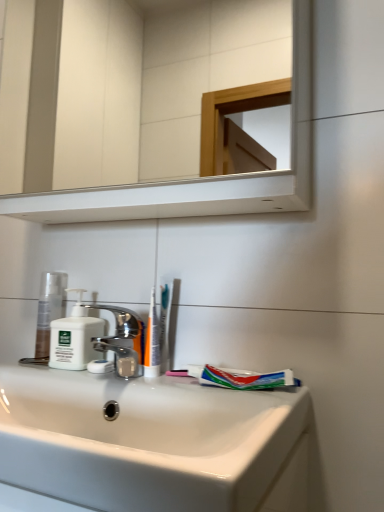
Question: Can you confirm if white matte soap dispenser at left is smaller than white glossy sink at lower center?

Choices:
 (A) yes
 (B) no

Answer: (A)

Question: Does white matte soap dispenser at left lie in front of white glossy sink at lower center?

Choices:
 (A) yes
 (B) no

Answer: (B)

Question: Is white matte soap dispenser at left positioned behind white glossy sink at lower center?

Choices:
 (A) no
 (B) yes

Answer: (B)

Question: Is white matte soap dispenser at left at the left side of white glossy sink at lower center?

Choices:
 (A) yes
 (B) no

Answer: (A)

Question: Can you confirm if white matte soap dispenser at left is bigger than white glossy sink at lower center?

Choices:
 (A) yes
 (B) no

Answer: (B)

Question: From the image's perspective, is white matte soap dispenser at left located beneath white glossy sink at lower center?

Choices:
 (A) no
 (B) yes

Answer: (A)

Question: Is matte white lotion at left located outside white plastic toothbrush at center?

Choices:
 (A) yes
 (B) no

Answer: (A)

Question: Can you confirm if matte white lotion at left is shorter than white plastic toothbrush at center?

Choices:
 (A) no
 (B) yes

Answer: (A)

Question: From the image's perspective, is matte white lotion at left over white plastic toothbrush at center?

Choices:
 (A) yes
 (B) no

Answer: (B)

Question: Does matte white lotion at left have a greater width compared to white plastic toothbrush at center?

Choices:
 (A) no
 (B) yes

Answer: (B)

Question: Is matte white lotion at left at the right side of white plastic toothbrush at center?

Choices:
 (A) no
 (B) yes

Answer: (A)

Question: Considering the relative sizes of matte white lotion at left and white plastic toothbrush at center in the image provided, is matte white lotion at left taller than white plastic toothbrush at center?

Choices:
 (A) yes
 (B) no

Answer: (A)

Question: From the image's perspective, is white glossy sink at lower center over white glossy mirror at upper center?

Choices:
 (A) yes
 (B) no

Answer: (B)